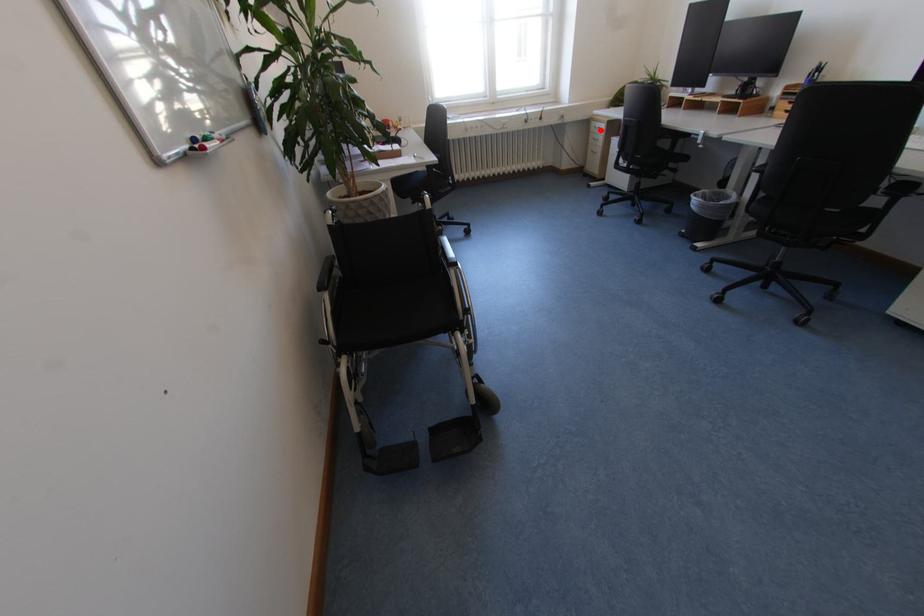
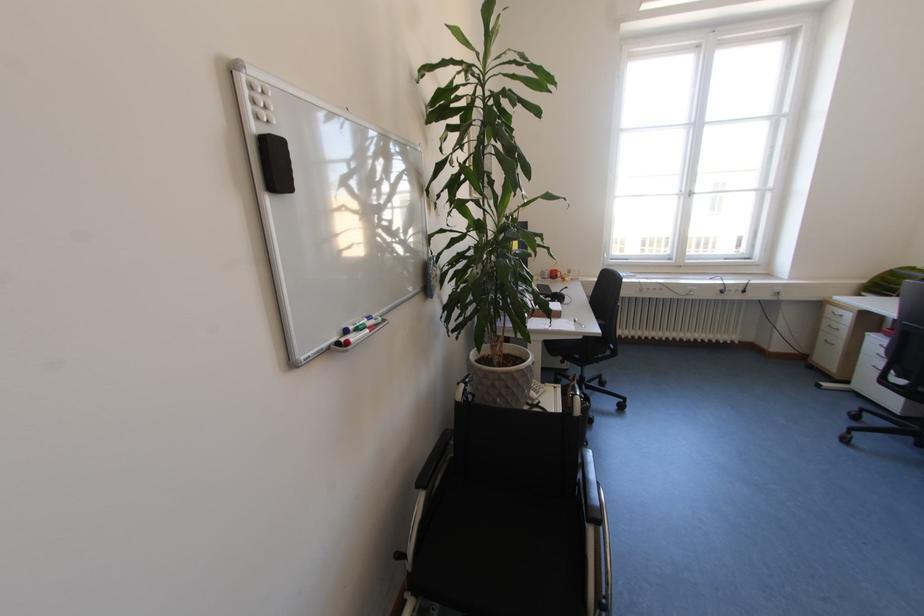
Locate, in the second image, the point that corresponds to the highlighted location in the first image.

(835, 315)